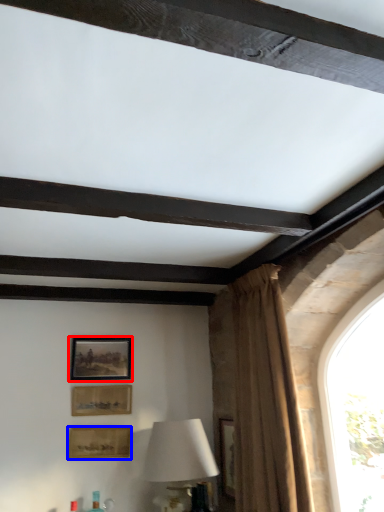
Question: Which object is closer to the camera taking this photo, picture frame (highlighted by a red box) or picture frame (highlighted by a blue box)?

Choices:
 (A) picture frame
 (B) picture frame

Answer: (B)